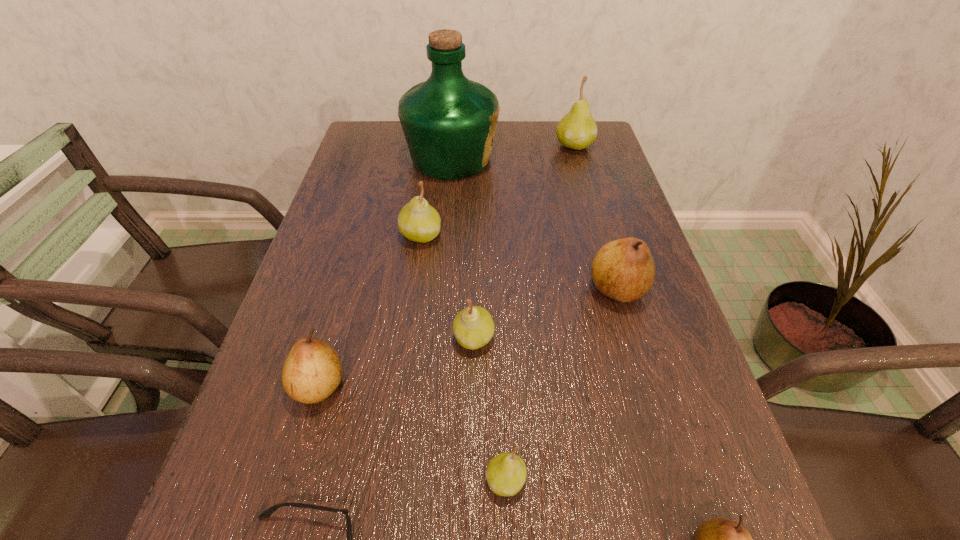
Image resolution: width=960 pixels, height=540 pixels. In order to click on free space located on the left of the nearest green pear in this screenshot , I will do `click(324, 480)`.

In order to click on liquor situated at the far edge in this screenshot , I will do `click(449, 122)`.

At what (x,y) coordinates should I click in order to perform the action: click on pear positioned at the far edge. Please return your answer as a coordinate pair (x, y). The image size is (960, 540). Looking at the image, I should click on (577, 130).

Locate an element on the screen. object positioned at the left edge is located at coordinates (312, 370).

Find the location of a particular element. object that is at the far right corner is located at coordinates click(577, 130).

Find the location of a particular element. This screenshot has height=540, width=960. blank space at the far edge is located at coordinates (540, 142).

Identify the location of free space at the left edge of the desktop. This screenshot has width=960, height=540. (342, 279).

The height and width of the screenshot is (540, 960). In order to click on free space at the right edge of the desktop in this screenshot , I will do `click(614, 220)`.

Where is `free space between the farthest brown pear and the smallest green pear`? free space between the farthest brown pear and the smallest green pear is located at coordinates (562, 384).

This screenshot has height=540, width=960. What are the coordinates of `unoccupied position between the sixth nearest pear and the biggest brown pear` in the screenshot? It's located at (518, 262).